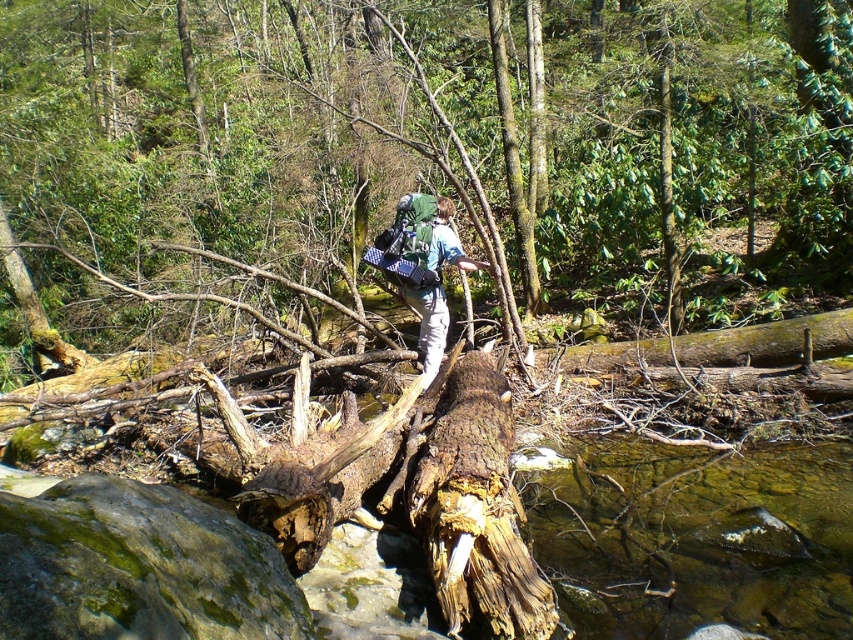
Question: Which object appears closest to the camera in this image?

Choices:
 (A) rusty wood log at center
 (B) matte blue shirt at center

Answer: (A)

Question: Which object appears closest to the camera in this image?

Choices:
 (A) rusty wood log at center
 (B) rough bark log at center
 (C) matte blue shirt at center

Answer: (A)

Question: Can you confirm if rusty wood log at center is positioned above matte blue shirt at center?

Choices:
 (A) no
 (B) yes

Answer: (A)

Question: In this image, where is rough bark log at center located relative to rusty wood log at center?

Choices:
 (A) above
 (B) below

Answer: (A)

Question: Is rough bark log at center above rusty wood log at center?

Choices:
 (A) yes
 (B) no

Answer: (A)

Question: Among these objects, which one is farthest from the camera?

Choices:
 (A) matte blue shirt at center
 (B) rusty wood log at center

Answer: (A)